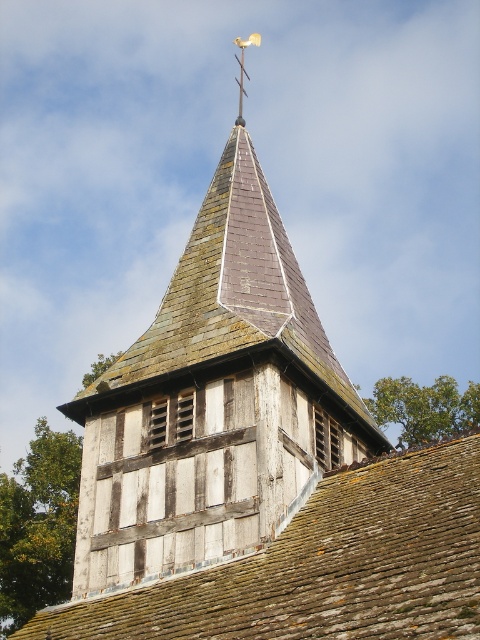
Can you confirm if weathered wood steeple at center is positioned below metallic weather vane at upper center?

Correct, weathered wood steeple at center is located below metallic weather vane at upper center.

This screenshot has width=480, height=640. In order to click on weathered wood steeple at center in this screenshot , I will do `click(214, 401)`.

Which is behind, point (379, 612) or point (237, 44)?

Positioned behind is point (237, 44).

Is weathered brown shingles at center taller than metallic weather vane at upper center?

No.

This screenshot has width=480, height=640. Describe the element at coordinates (324, 566) in the screenshot. I see `weathered brown shingles at center` at that location.

Where is `weathered brown shingles at center`? weathered brown shingles at center is located at coordinates (324, 566).

From the picture: Can you confirm if weathered wood steeple at center is smaller than weathered brown shingles at center?

Incorrect, weathered wood steeple at center is not smaller in size than weathered brown shingles at center.

Can you confirm if weathered wood steeple at center is positioned below weathered brown shingles at center?

Incorrect, weathered wood steeple at center is not positioned below weathered brown shingles at center.

The width and height of the screenshot is (480, 640). Identify the location of weathered wood steeple at center. point(214,401).